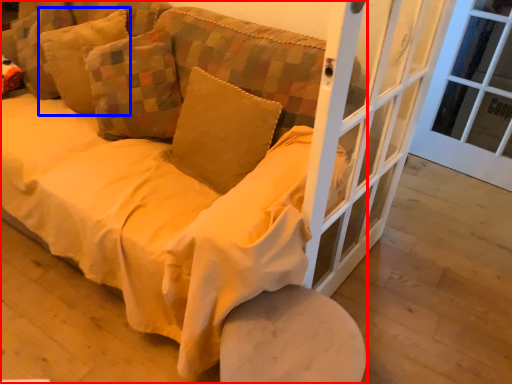
Question: Among these objects, which one is nearest to the camera, studio couch (highlighted by a red box) or pillow (highlighted by a blue box)?

Choices:
 (A) studio couch
 (B) pillow

Answer: (A)